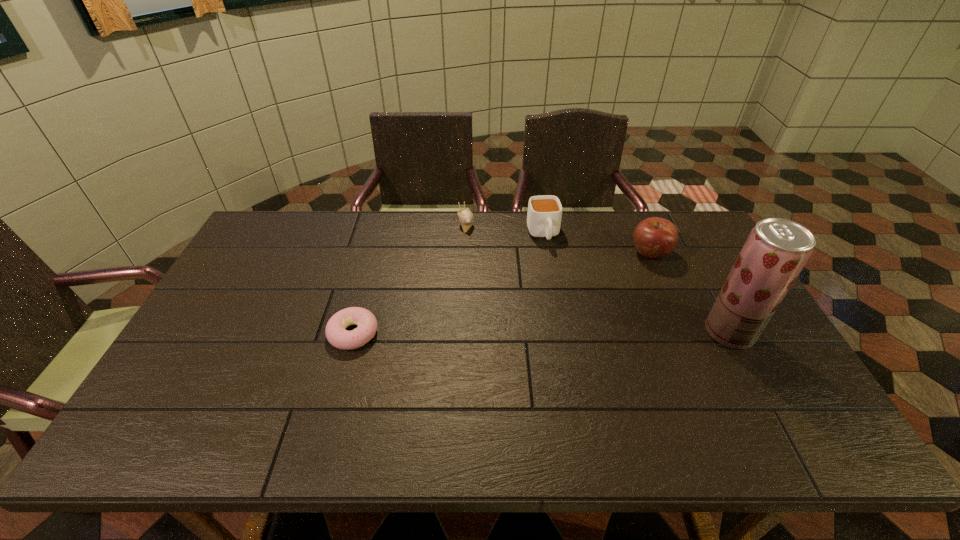
Find the location of a particular element. This screenshot has height=540, width=960. vacant space on the desktop that is between the shortest object and the tallest object and is positioned on the side with the handle of the cup is located at coordinates (574, 333).

At what (x,y) coordinates should I click in order to perform the action: click on free spot on the desktop that is between the doughnut and the fruit juice and is positioned on the side of the apple with the unique marking. Please return your answer as a coordinate pair (x, y). The image size is (960, 540). Looking at the image, I should click on (563, 333).

The height and width of the screenshot is (540, 960). I want to click on free space on the desktop that is between the leftmost object and the tallest object and is positioned on the shell of the escargot, so click(506, 333).